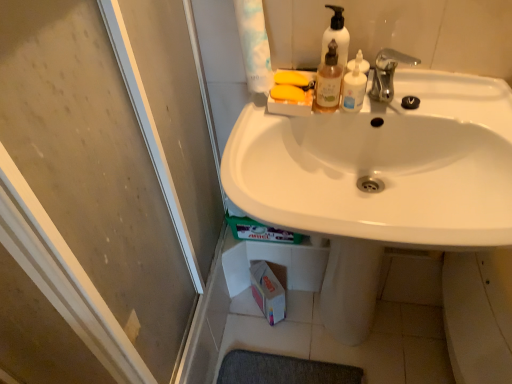
Find the location of a particular element. free spot to the right of white plastic mouthwash at upper center, positioned as the first mouthwash in right-to-left order is located at coordinates (438, 99).